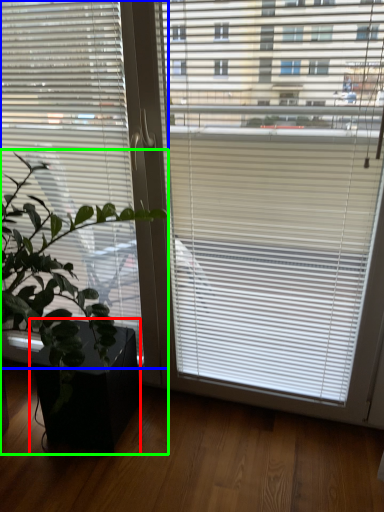
Question: Based on their relative distances, which object is farther from flowerpot (highlighted by a red box)? Choose from window blind (highlighted by a blue box) and houseplant (highlighted by a green box).

Choices:
 (A) window blind
 (B) houseplant

Answer: (A)